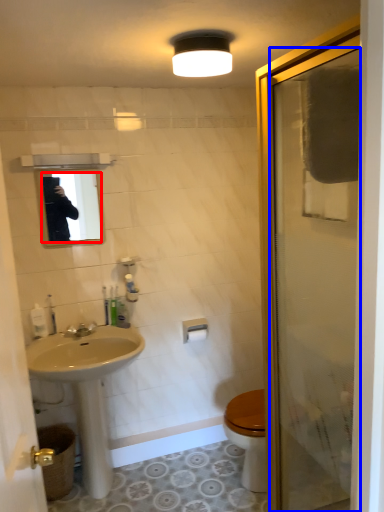
Question: Which object appears closest to the camera in this image, mirror (highlighted by a red box) or door (highlighted by a blue box)?

Choices:
 (A) mirror
 (B) door

Answer: (B)